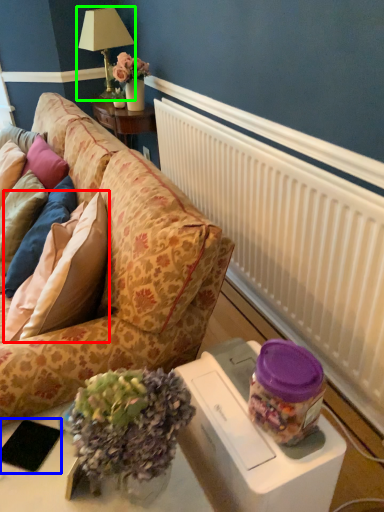
Question: Which object is the farthest from pillow (highlighted by a red box)? Choose among these: pad (highlighted by a blue box) or table lamp (highlighted by a green box).

Choices:
 (A) pad
 (B) table lamp

Answer: (B)